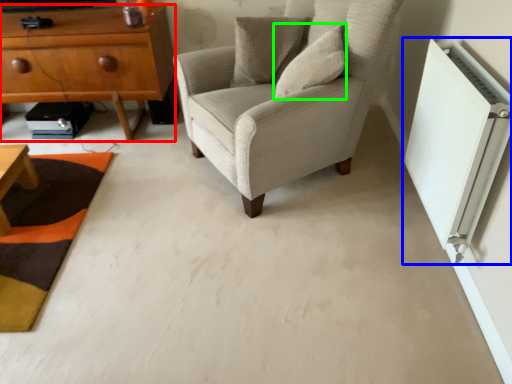
Question: Which object is the closest to the chest of drawers (highlighted by a red box)? Choose among these: air conditioning (highlighted by a blue box) or pillow (highlighted by a green box).

Choices:
 (A) air conditioning
 (B) pillow

Answer: (B)